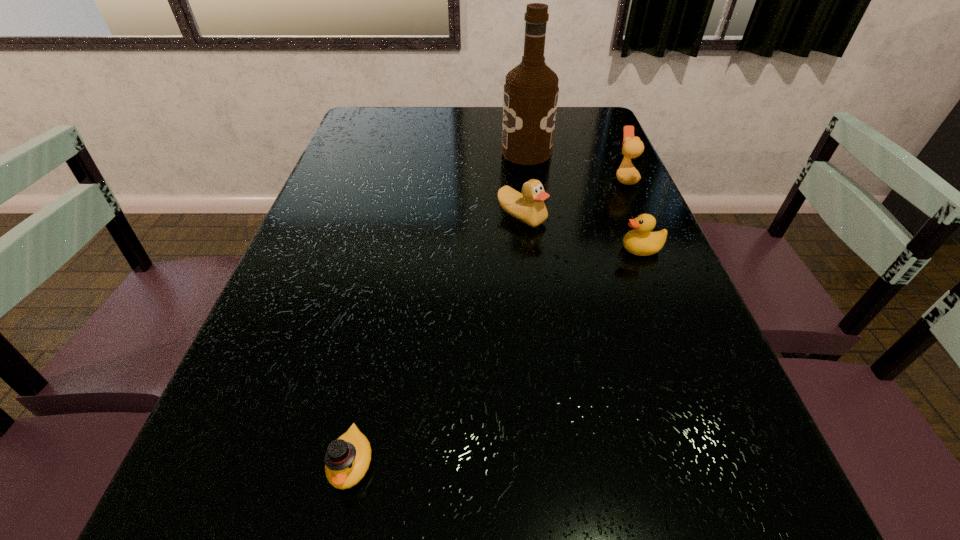
Identify the location of vacant space at the right edge. The width and height of the screenshot is (960, 540). (719, 382).

Image resolution: width=960 pixels, height=540 pixels. In the image, there is a desktop. Identify the location of blank space at the far left corner. (384, 113).

The height and width of the screenshot is (540, 960). Find the location of `free space at the far right corner of the desktop`. free space at the far right corner of the desktop is located at coordinates (600, 111).

The width and height of the screenshot is (960, 540). What are the coordinates of `empty location between the second nearest duck and the shortest object` in the screenshot? It's located at (496, 356).

At what (x,y) coordinates should I click in order to perform the action: click on free point between the second farthest object and the second farthest duck. Please return your answer as a coordinate pair (x, y). Looking at the image, I should click on (573, 198).

Where is `vacant region between the alcohol and the farthest duck`? The image size is (960, 540). vacant region between the alcohol and the farthest duck is located at coordinates [x=576, y=166].

Image resolution: width=960 pixels, height=540 pixels. I want to click on free space between the second duck from left to right and the fourth tallest object, so click(x=582, y=233).

I want to click on free spot between the second nearest duck and the third nearest duck, so click(582, 233).

Find the location of a particular element. Image resolution: width=960 pixels, height=540 pixels. free spot between the farthest object and the second farthest object is located at coordinates (576, 166).

This screenshot has height=540, width=960. Identify the location of free area in between the third duck from right to left and the leftmost duck. (437, 340).